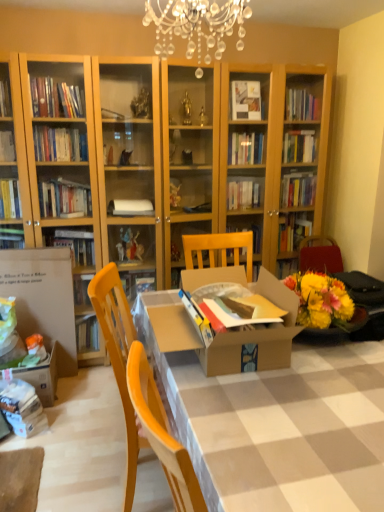
Image resolution: width=384 pixels, height=512 pixels. In order to click on brown cardboard table at center in this screenshot , I will do coord(214,338).

Locate an element on the screen. The width and height of the screenshot is (384, 512). wooden chair at center is located at coordinates (140, 395).

Image resolution: width=384 pixels, height=512 pixels. Identify the location of brown cardboard table at center. (214, 338).

Is cardboard box at center facing away from brown cardboard table at center?

No, brown cardboard table at center is not at the back of cardboard box at center.

In the image, is cardboard box at center positioned in front of or behind brown cardboard table at center?

cardboard box at center is in front of brown cardboard table at center.

Can you tell me how much cardboard box at center and brown cardboard table at center differ in facing direction?

cardboard box at center and brown cardboard table at center are facing 89.9 degrees away from each other.

Is cardboard box at center touching brown cardboard table at center?

There is a gap between cardboard box at center and brown cardboard table at center.

Is the depth of cardboard box at center greater than that of white cardboard box at left?

No.

Does cardboard box at center have a lesser height compared to white cardboard box at left?

Indeed, cardboard box at center has a lesser height compared to white cardboard box at left.

How many degrees apart are the facing directions of cardboard box at center and white cardboard box at left?

There is a 89.6-degree angle between the facing directions of cardboard box at center and white cardboard box at left.

Which is more to the right, cardboard box at center or white cardboard box at left?

From the viewer's perspective, cardboard box at center appears more on the right side.

Is brown cardboard table at center in front of or behind cardboard box at center in the image?

In the image, brown cardboard table at center appears behind cardboard box at center.

In terms of height, does brown cardboard table at center look taller or shorter compared to cardboard box at center?

Considering their sizes, brown cardboard table at center has less height than cardboard box at center.

Which object is thinner, brown cardboard table at center or cardboard box at center?

Thinner between the two is brown cardboard table at center.

Is white cardboard box at left not within cardboard box at center?

That's correct, white cardboard box at left is outside of cardboard box at center.

Considering the relative sizes of white cardboard box at left and cardboard box at center in the image provided, is white cardboard box at left wider than cardboard box at center?

No.

Considering the sizes of objects white cardboard box at left and cardboard box at center in the image provided, who is smaller, white cardboard box at left or cardboard box at center?

With smaller size is white cardboard box at left.

Can you confirm if white cardboard box at left is taller than cardboard box at center?

Indeed, white cardboard box at left has a greater height compared to cardboard box at center.

Is white cardboard box at left taller than wooden chair at center?

In fact, white cardboard box at left may be shorter than wooden chair at center.

Between white cardboard box at left and wooden chair at center, which one is positioned behind?

white cardboard box at left is behind.

Which point is more forward, [44,275] or [93,306]?

The point [93,306] is closer.

In terms of width, does wooden chair at center look wider or thinner when compared to white cardboard box at left?

In the image, wooden chair at center appears to be wider than white cardboard box at left.

You are a GUI agent. You are given a task and a screenshot of the screen. Output one action in this format:
    pyautogui.click(x=<x>, y=<y>)
    Task: Click on the chair on the right of white cardboard box at left
    
    Given the screenshot: What is the action you would take?
    pyautogui.click(x=140, y=395)

Measure the distance from wooden chair at center to white cardboard box at left.

1.24 meters.

Would you say wooden chair at center is outside white cardboard box at left?

wooden chair at center lies outside white cardboard box at left's area.

From the image's perspective, which is below, white cardboard box at left or brown cardboard table at center?

white cardboard box at left, from the image's perspective.

Is white cardboard box at left in front of or behind brown cardboard table at center in the image?

white cardboard box at left is positioned farther from the viewer than brown cardboard table at center.

Could you tell me if white cardboard box at left is turned towards brown cardboard table at center?

No, white cardboard box at left is not oriented towards brown cardboard table at center.

The image size is (384, 512). What are the coordinates of `desk in front of the brown cardboard table at center` in the screenshot? It's located at (277, 423).

This screenshot has height=512, width=384. I want to click on desk below the white cardboard box at left (from the image's perspective), so click(277, 423).

From the picture: Looking at the image, which one is located closer to brown cardboard table at center, cardboard box at center or wooden chair at center?

cardboard box at center is closer to brown cardboard table at center.

In the scene shown: From the image, which object appears to be nearer to white cardboard box at left, cardboard box at center or brown cardboard table at center?

brown cardboard table at center.

Estimate the real-world distances between objects in this image. Which object is further from wooden chair at center, cardboard box at center or brown cardboard table at center?

brown cardboard table at center is further to wooden chair at center.

Which object lies nearer to the anchor point brown cardboard table at center, cardboard box at center or white cardboard box at left?

Based on the image, cardboard box at center appears to be nearer to brown cardboard table at center.

Looking at the image, which one is located closer to brown cardboard table at center, white cardboard box at left or cardboard box at center?

The object closer to brown cardboard table at center is cardboard box at center.

When comparing their distances from wooden chair at center, does brown cardboard table at center or cardboard box at center seem closer?

cardboard box at center is closer to wooden chair at center.

Based on their spatial positions, is cardboard box at center or white cardboard box at left further from wooden chair at center?

white cardboard box at left is further to wooden chair at center.

Looking at the image, which one is located closer to wooden chair at center, brown cardboard table at center or white cardboard box at left?

brown cardboard table at center is positioned closer to the anchor wooden chair at center.

The width and height of the screenshot is (384, 512). I want to click on table between cardboard box at center and white cardboard box at left from front to back, so click(x=214, y=338).

You are a GUI agent. You are given a task and a screenshot of the screen. Output one action in this format:
    pyautogui.click(x=<x>, y=<y>)
    Task: Click on the chair located between cardboard box at center and white cardboard box at left in the depth direction
    This screenshot has width=384, height=512.
    Given the screenshot: What is the action you would take?
    pyautogui.click(x=140, y=395)

This screenshot has height=512, width=384. I want to click on table positioned between cardboard box at center and wooden chair at center from near to far, so click(214, 338).

The width and height of the screenshot is (384, 512). Identify the location of chair positioned between brown cardboard table at center and white cardboard box at left from near to far. (140, 395).